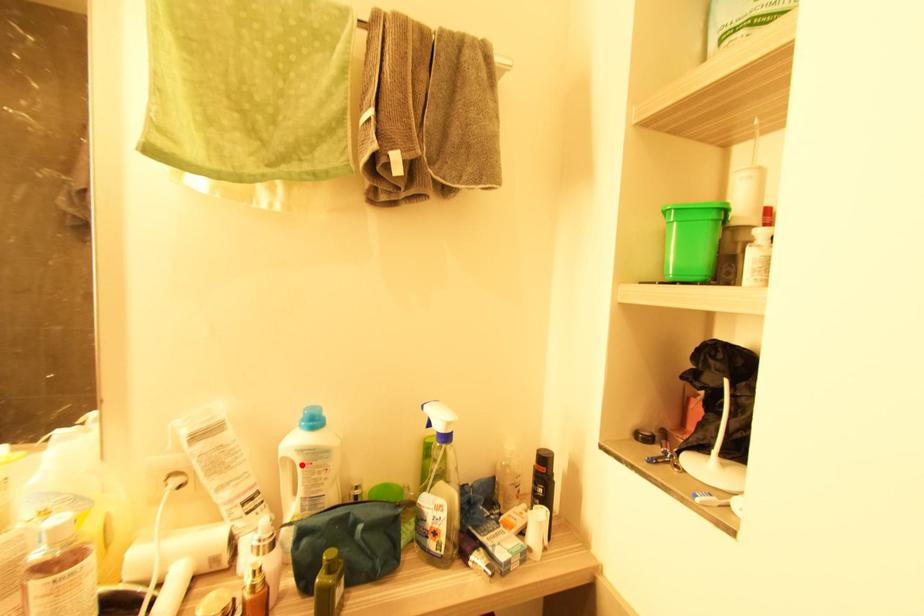
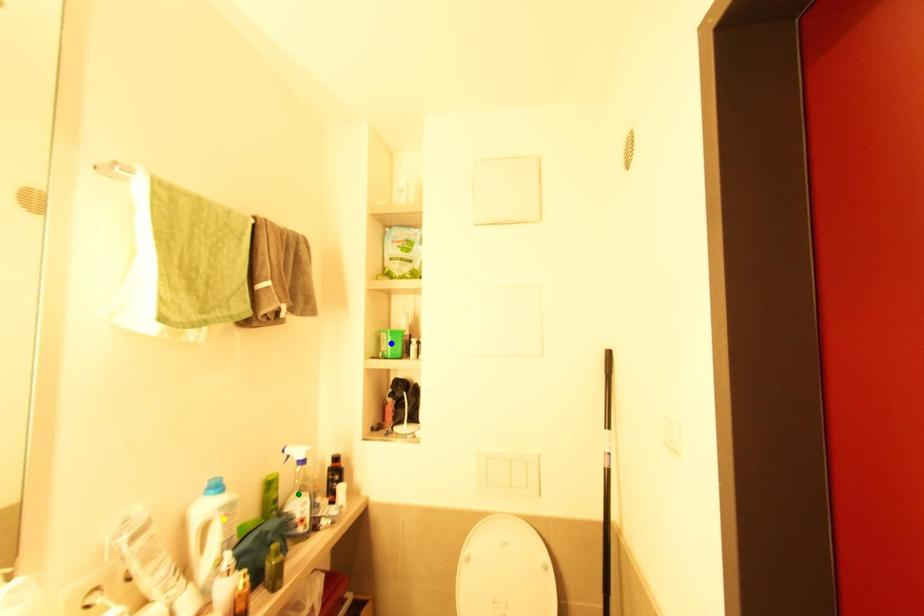
Question: I am providing you with two images of the same scene from different viewpoints. A red point is marked on the first image. You are given multiple points on the second image. Can you choose the point in image 2 that corresponds to the point in image 1?

Choices:
 (A) green point
 (B) yellow point
 (C) blue point

Answer: (B)